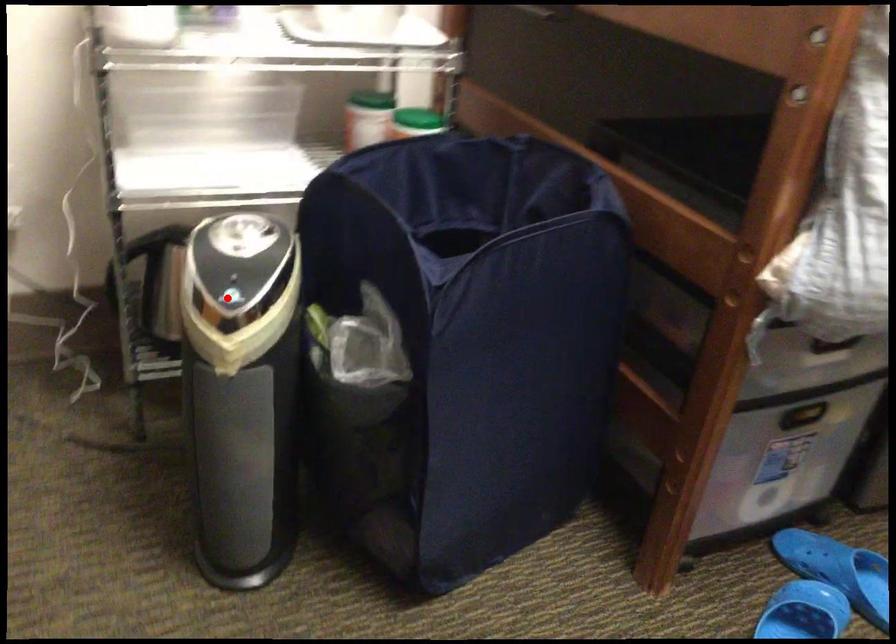
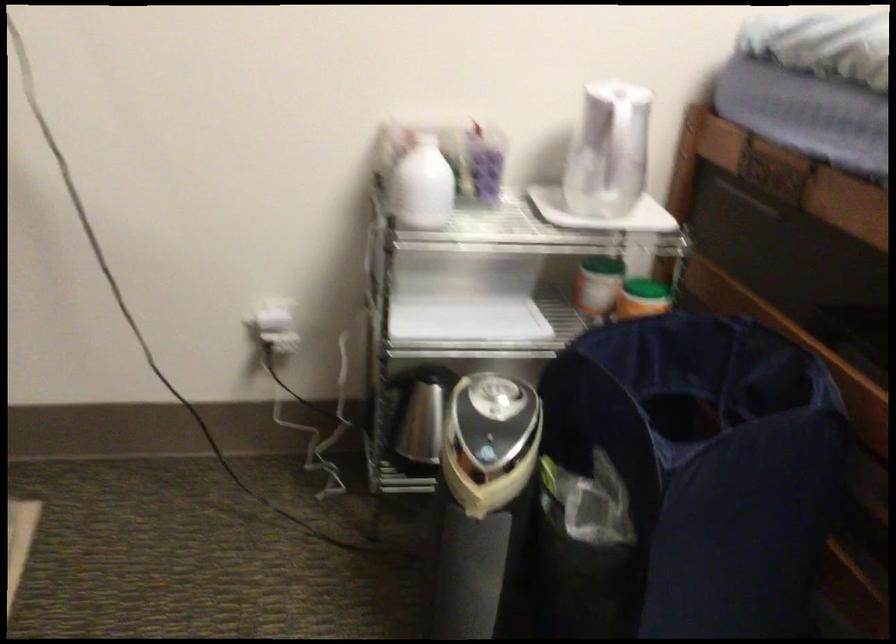
Question: I am providing you with two images of the same scene from different viewpoints. Given a red point in image1, look at the same physical point in image2. Is it:

Choices:
 (A) Closer to the viewpoint
 (B) Farther from the viewpoint

Answer: (B)